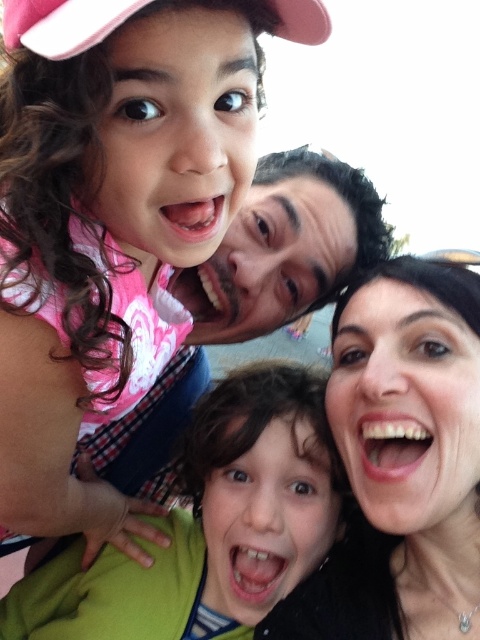
You are standing 5 feet away from the camera. Can you reach the point at coordinates point (x=451, y=618)?

The point at coordinates point (x=451, y=618) is 4.97 feet away from the camera, so yes, you can reach it since you are standing 5 feet away from the camera.

In the scene where four family members are smiling, which face is positioned to the right of the other between the smooth skin face at upper right and the matte black face at center?

The smooth skin face at upper right is positioned to the right of the matte black face at center.